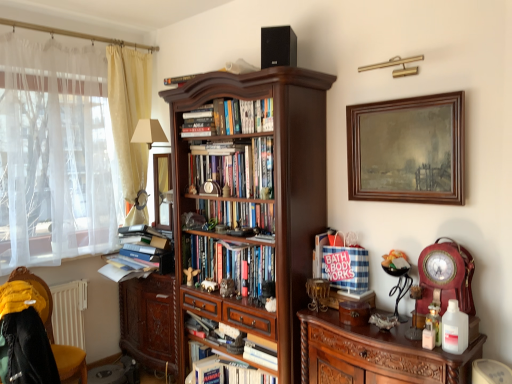
At what (x,y) coordinates should I click in order to perform the action: click on blank space situated above brown carved wooden cabinet at lower right (from a real-world perspective). Please return your answer as a coordinate pair (x, y). The image size is (512, 384). Looking at the image, I should click on [x=384, y=331].